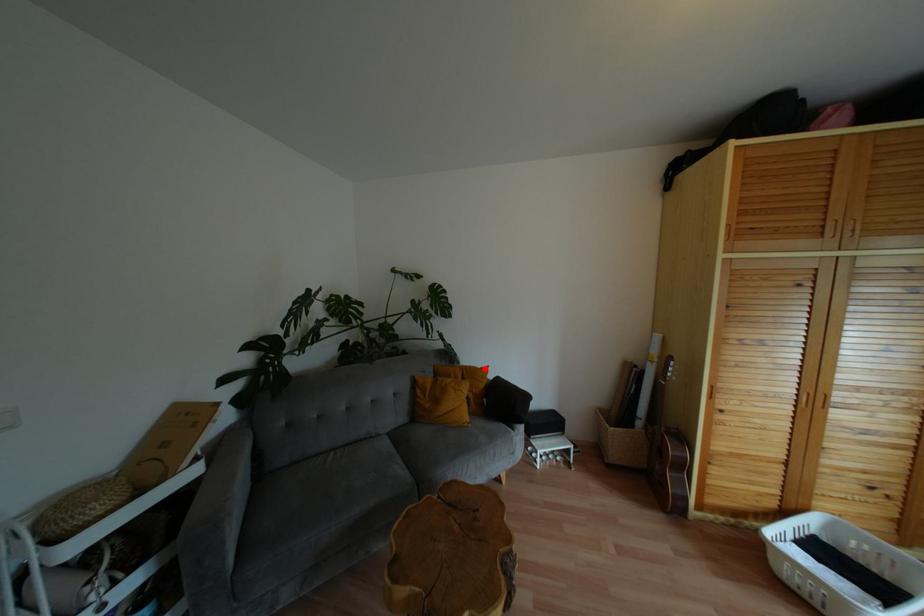
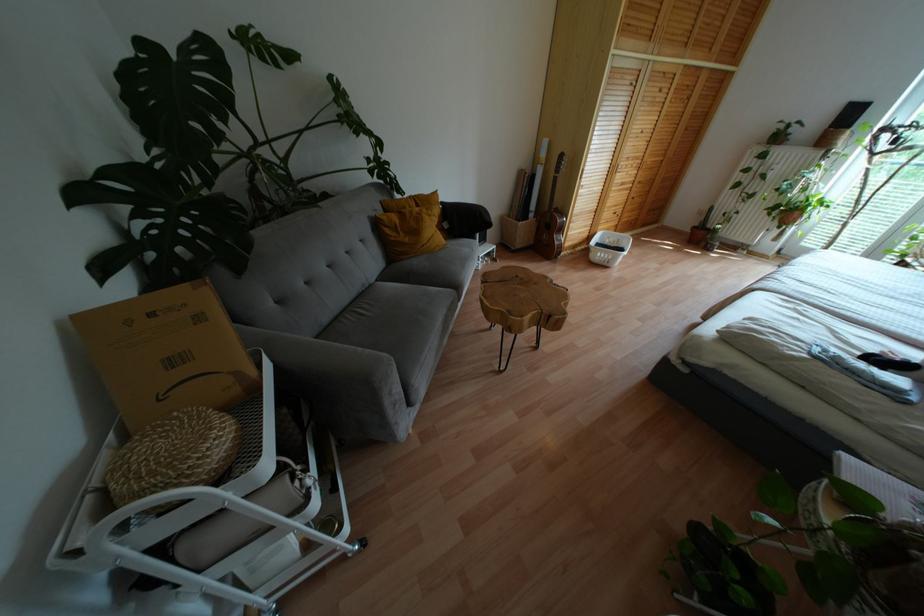
Question: I am providing you with two images of the same scene from different viewpoints. Image1 has a red point marked. In image2, the corresponding 3D location appears at what relative position? Reply with the corresponding letter.

Choices:
 (A) Closer
 (B) Farther

Answer: (A)